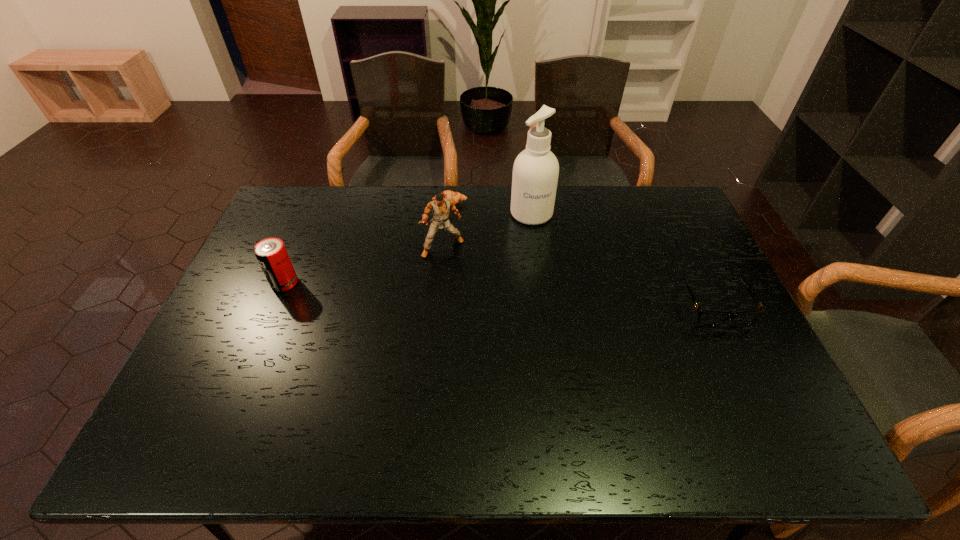
Locate an element on the screen. This screenshot has width=960, height=540. the leftmost object is located at coordinates (271, 253).

Find the location of a particular element. the third shortest object is located at coordinates (271, 253).

The height and width of the screenshot is (540, 960). What are the coordinates of `the second shortest object` in the screenshot? It's located at (710, 318).

What are the coordinates of `sunglasses` in the screenshot? It's located at (710, 318).

Image resolution: width=960 pixels, height=540 pixels. Find the location of `pastry`. pastry is located at coordinates (456, 197).

In order to click on the second tallest object in this screenshot , I will do `click(440, 207)`.

The width and height of the screenshot is (960, 540). What are the coordinates of `puncher` in the screenshot? It's located at (440, 207).

You are a GUI agent. You are given a task and a screenshot of the screen. Output one action in this format:
    pyautogui.click(x=<x>, y=<y>)
    Task: Click on the cleansing agent
    This screenshot has width=960, height=540.
    Given the screenshot: What is the action you would take?
    pyautogui.click(x=535, y=175)

You are a GUI agent. You are given a task and a screenshot of the screen. Output one action in this format:
    pyautogui.click(x=<x>, y=<y>)
    Task: Click on the tallest object
    
    Given the screenshot: What is the action you would take?
    pyautogui.click(x=535, y=175)

Locate an element on the screen. free spot located 0.330m on the back of the can is located at coordinates (317, 207).